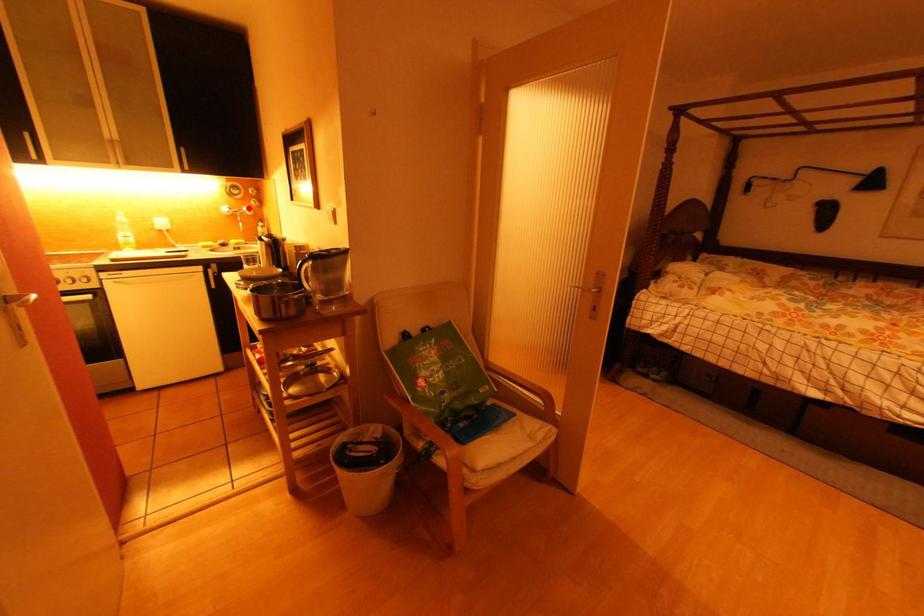
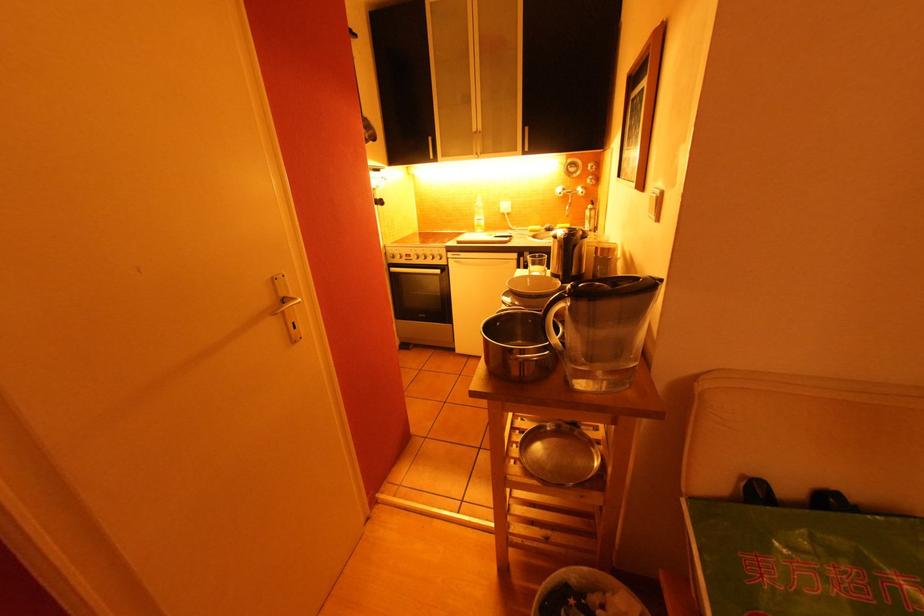
Where in the second image is the point corresponding to the highlighted location from the first image?

(582, 187)